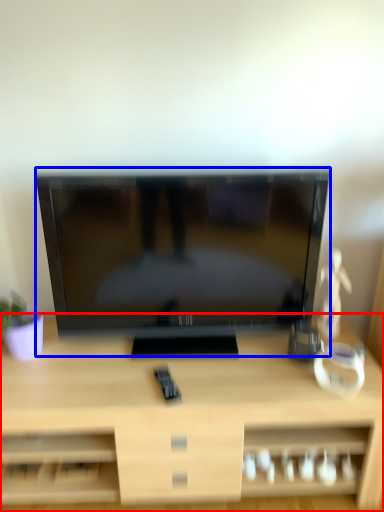
Question: Which point is closer to the camera, desk (highlighted by a red box) or television (highlighted by a blue box)?

Choices:
 (A) desk
 (B) television

Answer: (A)